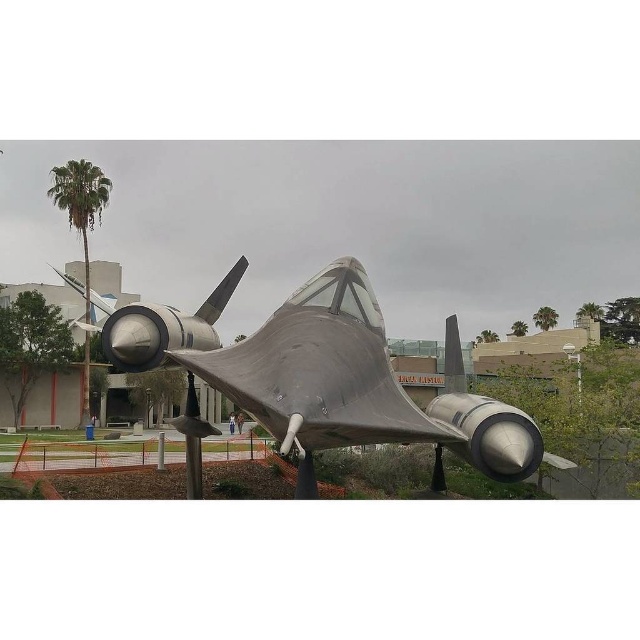
Question: Which point is closer to the camera?

Choices:
 (A) polished silver aircraft at center
 (B) green leafy palm tree at upper right
 (C) green leafy palm tree at left

Answer: (A)

Question: Which object appears farthest from the camera in this image?

Choices:
 (A) green leafy palm tree at left
 (B) green leafy palm tree at upper right
 (C) polished silver aircraft at center

Answer: (B)

Question: Which of these objects is positioned farthest from the polished silver aircraft at center?

Choices:
 (A) green leafy palm tree at left
 (B) green leafy palm tree at upper right

Answer: (B)

Question: Does polished silver aircraft at center appear under green leafy palm tree at upper right?

Choices:
 (A) yes
 (B) no

Answer: (A)

Question: Is polished silver aircraft at center to the right of green leafy palm tree at left from the viewer's perspective?

Choices:
 (A) no
 (B) yes

Answer: (B)

Question: Does green leafy palm tree at left appear on the left side of green leafy palm tree at upper right?

Choices:
 (A) yes
 (B) no

Answer: (A)